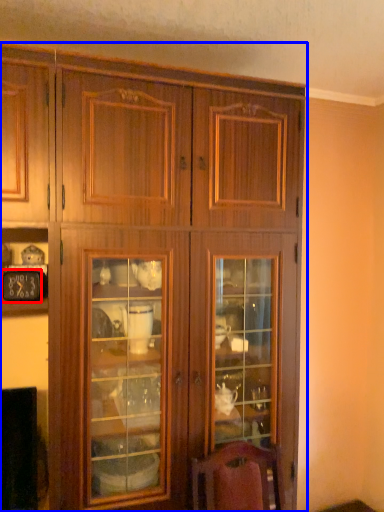
Question: Which of the following is the closest to the observer, clock (highlighted by a red box) or cupboard (highlighted by a blue box)?

Choices:
 (A) clock
 (B) cupboard

Answer: (B)